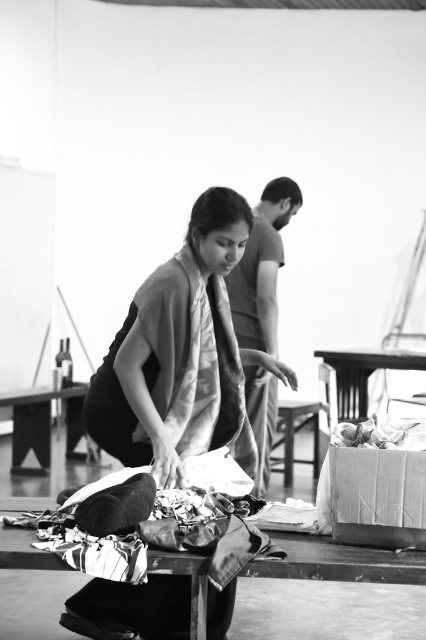
Can you confirm if silky black dress at center is thinner than wooden table at center?

Yes.

Who is positioned more to the right, silky black dress at center or wooden table at center?

From the viewer's perspective, wooden table at center appears more on the right side.

Between point (114, 372) and point (353, 362), which one is positioned in front?

Point (114, 372) is more forward.

The image size is (426, 640). I want to click on silky black dress at center, so click(x=181, y=355).

Does cardboard box at lower right have a greater width compared to wooden table at center?

No.

Is point (405, 429) positioned before point (362, 380)?

Yes, point (405, 429) is in front of point (362, 380).

What are the coordinates of `cardboard box at lower right` in the screenshot? It's located at (374, 483).

Between silky black dress at center and metallic reflective table at lower center, which one is positioned higher?

silky black dress at center is higher up.

Can you confirm if silky black dress at center is positioned to the right of metallic reflective table at lower center?

In fact, silky black dress at center is to the left of metallic reflective table at lower center.

The width and height of the screenshot is (426, 640). Find the location of `silky black dress at center`. silky black dress at center is located at coordinates (181, 355).

The image size is (426, 640). I want to click on silky black dress at center, so click(x=181, y=355).